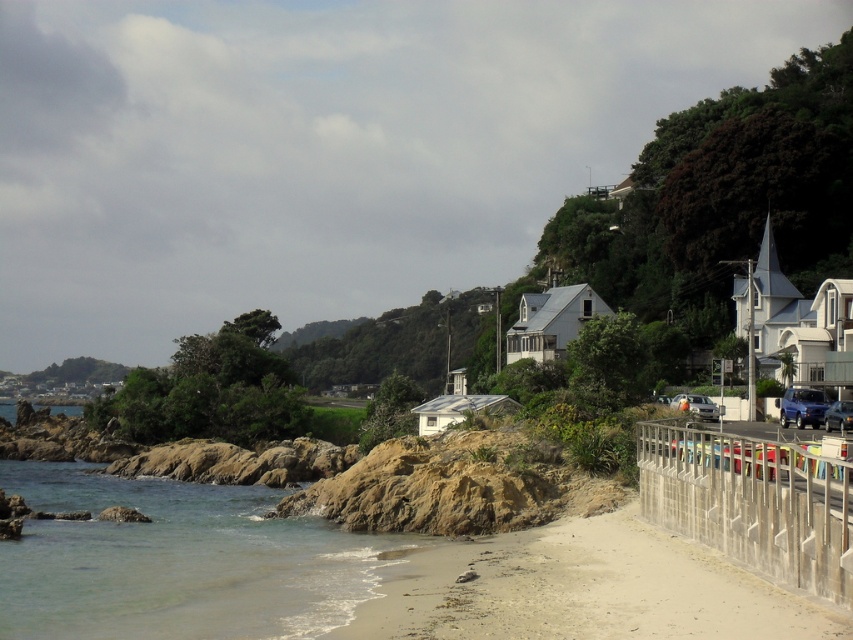
Question: Which object appears closest to the camera in this image?

Choices:
 (A) clear sandstone water at lower left
 (B) light beige sand at lower center
 (C) metallic silver car at lower right
 (D) metallic blue sedan at center-right

Answer: (B)

Question: Does light beige sand at lower center have a larger size compared to blue metallic car at lower right?

Choices:
 (A) no
 (B) yes

Answer: (B)

Question: Which object is farther from the camera taking this photo?

Choices:
 (A) clear sandstone water at lower left
 (B) metallic silver car at lower right
 (C) light beige sand at lower center
 (D) blue metallic car at lower right

Answer: (B)

Question: Which of the following is the farthest from the observer?

Choices:
 (A) gray concrete fence at lower right
 (B) metallic blue sedan at center-right

Answer: (B)

Question: Can you confirm if clear sandstone water at lower left is positioned to the left of gray concrete fence at lower right?

Choices:
 (A) no
 (B) yes

Answer: (B)

Question: Does gray concrete fence at lower right have a larger size compared to metallic silver car at lower right?

Choices:
 (A) no
 (B) yes

Answer: (A)